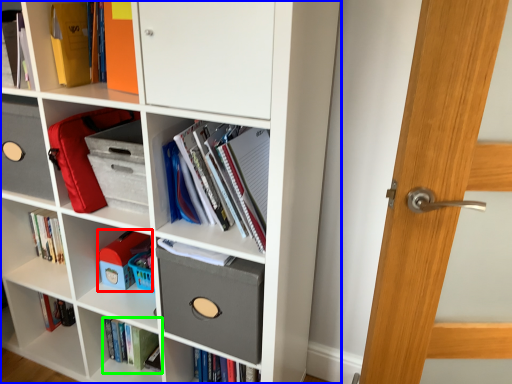
Question: Considering the real-world distances, which object is farthest from toy (highlighted by a red box)? bookcase (highlighted by a blue box) or book (highlighted by a green box)?

Choices:
 (A) bookcase
 (B) book

Answer: (A)